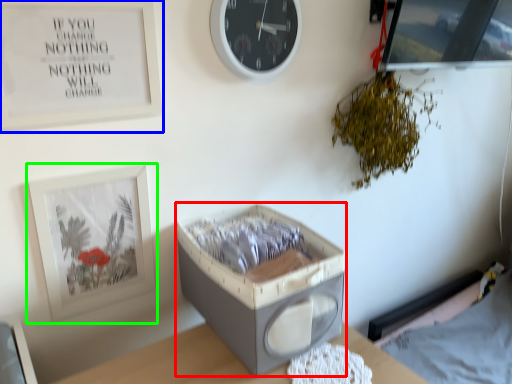
Question: Which object is the farthest from storage box (highlighted by a red box)? Choose among these: picture frame (highlighted by a blue box) or picture frame (highlighted by a green box).

Choices:
 (A) picture frame
 (B) picture frame

Answer: (A)